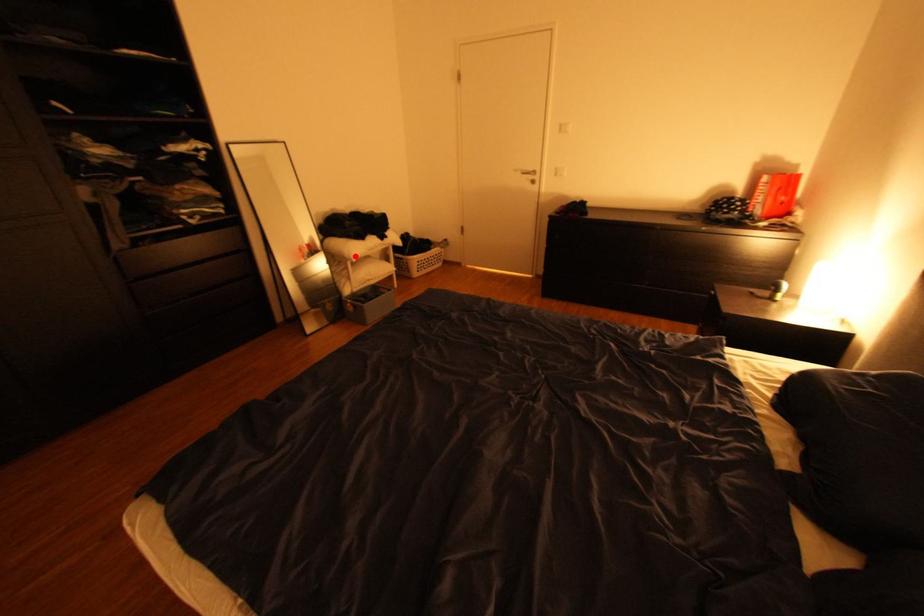
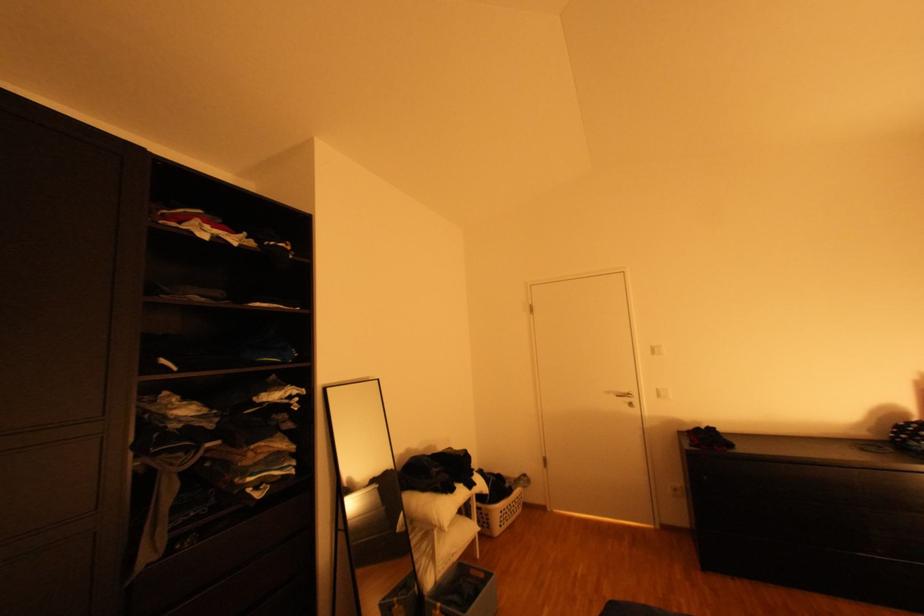
Find the pixel in the second image that matches the highlighted location in the first image.

(444, 523)